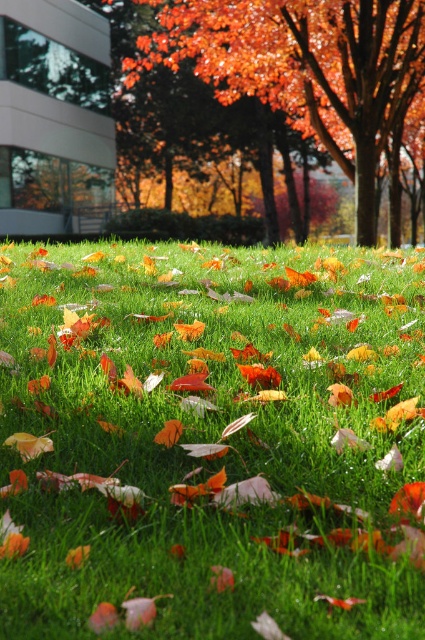
Does green grassy at center appear on the left side of orange matte tree at center?

Indeed, green grassy at center is positioned on the left side of orange matte tree at center.

Who is higher up, green grassy at center or orange matte tree at center?

orange matte tree at center is higher up.

Is point (314, 429) positioned after point (217, 49)?

No, it is in front of (217, 49).

Identify the location of green grassy at center. (210, 442).